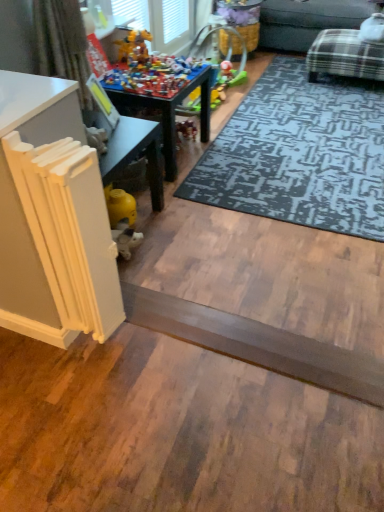
Question: In which direction should I rotate to look at wooden toy table at center, the first table from the back?

Choices:
 (A) left
 (B) right

Answer: (A)

Question: Is smooth gray plank at center taller than wooden toy table at center, the first table from the back?

Choices:
 (A) no
 (B) yes

Answer: (A)

Question: Is smooth gray plank at center positioned before wooden toy table at center, arranged as the second table when ordered from the bottom?

Choices:
 (A) no
 (B) yes

Answer: (B)

Question: Does smooth gray plank at center have a greater width compared to wooden toy table at center, arranged as the second table when ordered from the bottom?

Choices:
 (A) yes
 (B) no

Answer: (B)

Question: From the image's perspective, is smooth gray plank at center beneath wooden toy table at center, arranged as the first table when viewed from the top?

Choices:
 (A) no
 (B) yes

Answer: (B)

Question: Is smooth gray plank at center positioned with its back to wooden toy table at center, arranged as the second table when ordered from the bottom?

Choices:
 (A) yes
 (B) no

Answer: (B)

Question: Does smooth gray plank at center have a smaller size compared to wooden toy table at center, the first table from the back?

Choices:
 (A) yes
 (B) no

Answer: (A)

Question: Does multicolored plastic toys at center have a greater width compared to dark gray textured rug at center?

Choices:
 (A) no
 (B) yes

Answer: (A)

Question: Is multicolored plastic toys at center further to camera compared to dark gray textured rug at center?

Choices:
 (A) no
 (B) yes

Answer: (B)

Question: From the image's perspective, is multicolored plastic toys at center above dark gray textured rug at center?

Choices:
 (A) no
 (B) yes

Answer: (B)

Question: Is multicolored plastic toys at center outside of dark gray textured rug at center?

Choices:
 (A) no
 (B) yes

Answer: (B)

Question: Does multicolored plastic toys at center have a smaller size compared to dark gray textured rug at center?

Choices:
 (A) yes
 (B) no

Answer: (A)

Question: Does multicolored plastic toys at center come in front of dark gray textured rug at center?

Choices:
 (A) no
 (B) yes

Answer: (A)

Question: From a real-world perspective, is wooden toy table at center, which is the second table from front to back, physically below multicolored plastic toys at center?

Choices:
 (A) no
 (B) yes

Answer: (B)